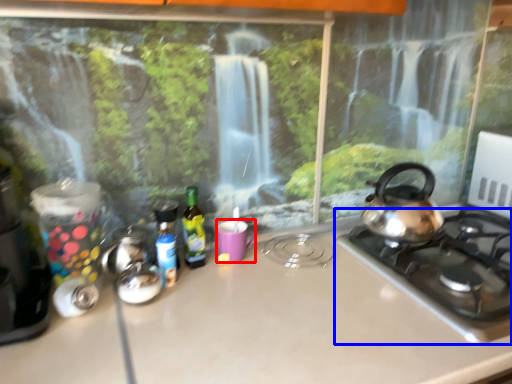
Question: Which object appears farthest to the camera in this image, mug (highlighted by a red box) or gas stove (highlighted by a blue box)?

Choices:
 (A) mug
 (B) gas stove

Answer: (A)